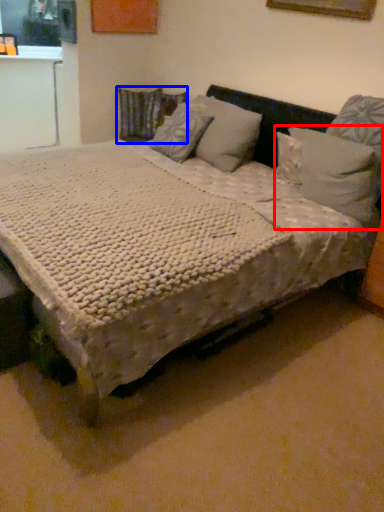
Question: Which point is closer to the camera, pillow (highlighted by a red box) or pillow (highlighted by a blue box)?

Choices:
 (A) pillow
 (B) pillow

Answer: (A)